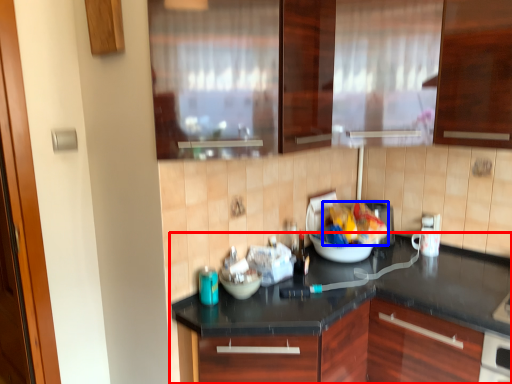
Question: Which object is closer to the camera taking this photo, countertop (highlighted by a red box) or food (highlighted by a blue box)?

Choices:
 (A) countertop
 (B) food

Answer: (A)